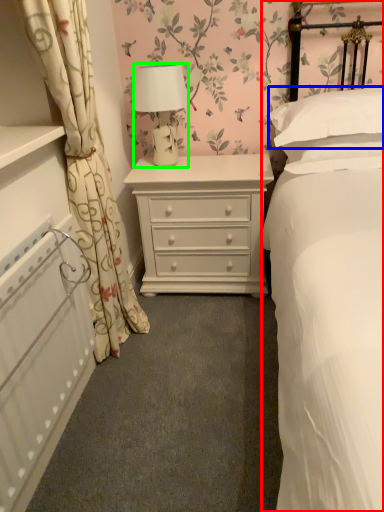
Question: Based on their relative distances, which object is farther from bed (highlighted by a red box)? Choose from pillow (highlighted by a blue box) and lamp (highlighted by a green box).

Choices:
 (A) pillow
 (B) lamp

Answer: (B)